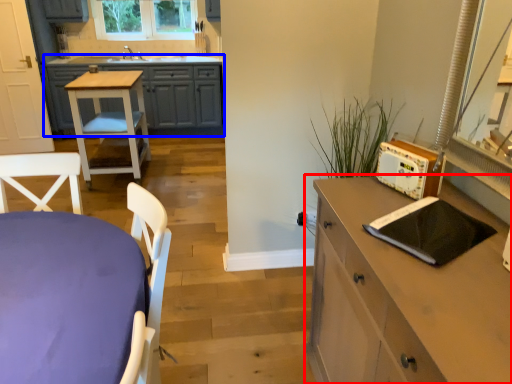
Question: Which object is closer to the camera taking this photo, chest of drawers (highlighted by a red box) or cabinetry (highlighted by a blue box)?

Choices:
 (A) chest of drawers
 (B) cabinetry

Answer: (A)